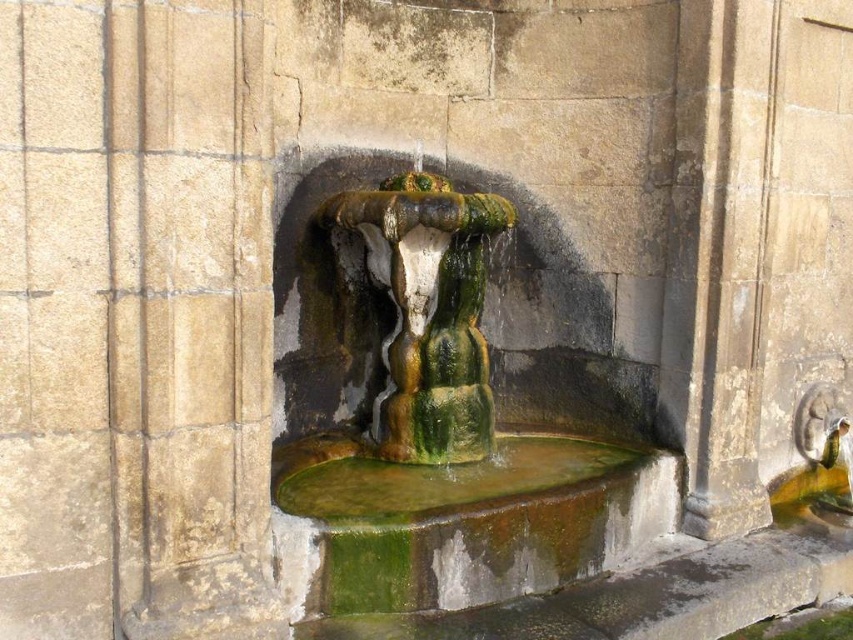
Looking at this image, between green mossy stone fountain at center and green mossy water at center, which one appears on the left side from the viewer's perspective?

green mossy stone fountain at center

Which is below, green mossy stone fountain at center or green mossy water at center?

green mossy water at center is lower down.

You are a GUI agent. You are given a task and a screenshot of the screen. Output one action in this format:
    pyautogui.click(x=<x>, y=<y>)
    Task: Click on the green mossy stone fountain at center
    The width and height of the screenshot is (853, 640).
    Given the screenshot: What is the action you would take?
    pyautogui.click(x=450, y=401)

This screenshot has height=640, width=853. What are the coordinates of `green mossy stone fountain at center` in the screenshot? It's located at (450, 401).

Identify the location of smooth stone pillar at right. The width and height of the screenshot is (853, 640). (722, 250).

Does smooth stone pillar at right come in front of green mossy water at center?

No, it is behind green mossy water at center.

Describe the element at coordinates (722, 250) in the screenshot. This screenshot has height=640, width=853. I see `smooth stone pillar at right` at that location.

Find the location of `smooth stone pillar at right`. smooth stone pillar at right is located at coordinates (722, 250).

Can you confirm if green glazed fountain at center is smaller than green mossy water at center?

No, green glazed fountain at center is not smaller than green mossy water at center.

Is point (454, 365) positioned after point (351, 484)?

Yes, point (454, 365) is farther from viewer.

You are a GUI agent. You are given a task and a screenshot of the screen. Output one action in this format:
    pyautogui.click(x=<x>, y=<y>)
    Task: Click on the green glazed fountain at center
    The image size is (853, 640).
    Given the screenshot: What is the action you would take?
    pyautogui.click(x=428, y=312)